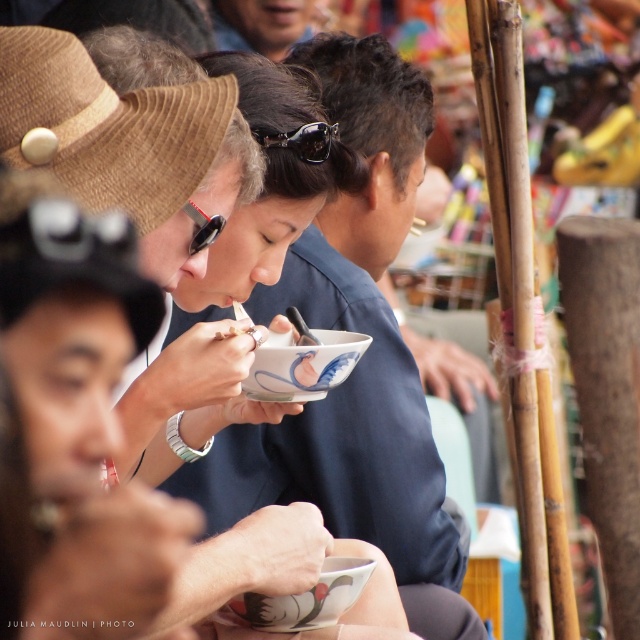
Does blue fabric shirt at center have a larger size compared to black rubber goggles at upper center?

Yes, blue fabric shirt at center is bigger than black rubber goggles at upper center.

Is blue fabric shirt at center to the left of black rubber goggles at upper center from the viewer's perspective?

Incorrect, blue fabric shirt at center is not on the left side of black rubber goggles at upper center.

This screenshot has height=640, width=640. In order to click on blue fabric shirt at center in this screenshot , I will do `click(371, 141)`.

Between brown corduroy hat at upper left and blue fabric shirt at center, which one appears on the right side from the viewer's perspective?

blue fabric shirt at center

Is point (188, 164) less distant than point (396, 60)?

Yes.

This screenshot has height=640, width=640. What are the coordinates of `brown corduroy hat at upper left` in the screenshot? It's located at (108, 125).

Can you confirm if blue fabric shirt at center is wider than black rubber goggles at center?

Indeed, blue fabric shirt at center has a greater width compared to black rubber goggles at center.

Who is positioned more to the right, blue fabric shirt at center or black rubber goggles at center?

blue fabric shirt at center

Which is behind, point (392, 100) or point (284, 145)?

Point (392, 100)

Find the location of a particular element. Image resolution: width=640 pixels, height=640 pixels. blue fabric shirt at center is located at coordinates (371, 141).